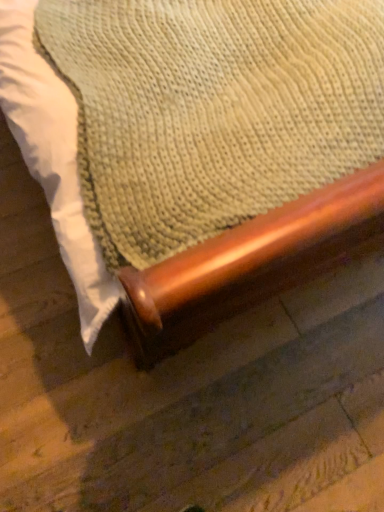
Where is `wooden bedpost at upper right`? The height and width of the screenshot is (512, 384). wooden bedpost at upper right is located at coordinates (197, 148).

This screenshot has width=384, height=512. What do you see at coordinates (197, 148) in the screenshot?
I see `wooden bedpost at upper right` at bounding box center [197, 148].

This screenshot has width=384, height=512. Identify the location of wooden bedpost at upper right. (197, 148).